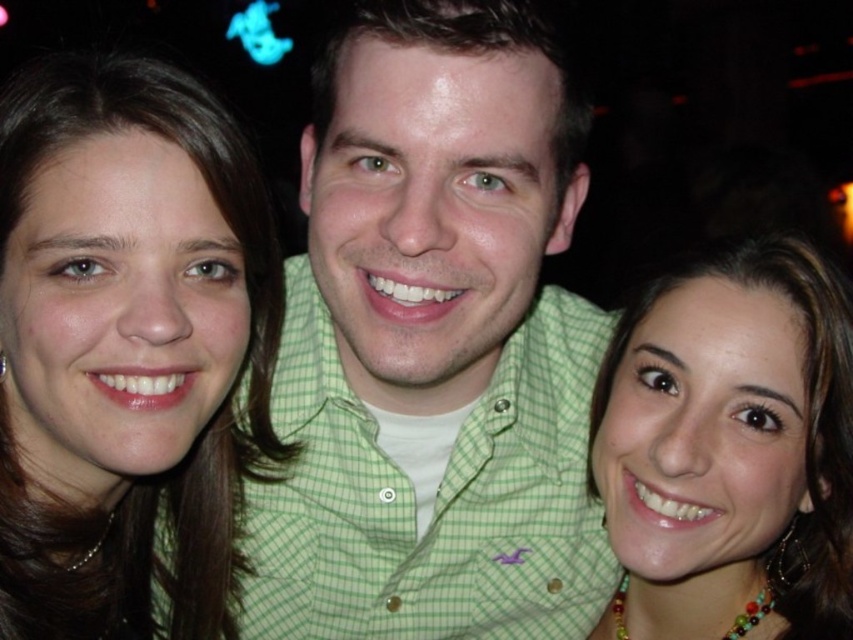
Does green checkered shirt at center have a lesser width compared to matte brown hair at center?

No.

Measure the distance between green checkered shirt at center and camera.

A distance of 29.92 inches exists between green checkered shirt at center and camera.

Is point (376, 627) farther from viewer compared to point (241, 209)?

Yes.

The image size is (853, 640). What are the coordinates of `green checkered shirt at center` in the screenshot? It's located at (434, 344).

Who is more distant from viewer, (199, 148) or (730, 504)?

The point (730, 504) is more distant.

Is matte brown hair at center in front of matte gold necklace at lower right?

Yes, it is in front of matte gold necklace at lower right.

Who is more distant from viewer, (x=222, y=358) or (x=788, y=387)?

The point (x=222, y=358) is behind.

In order to click on matte brown hair at center in this screenshot , I will do `click(126, 346)`.

Based on the photo, which is more to the left, green checkered shirt at center or matte gold necklace at lower right?

From the viewer's perspective, green checkered shirt at center appears more on the left side.

Between green checkered shirt at center and matte gold necklace at lower right, which one appears on the right side from the viewer's perspective?

From the viewer's perspective, matte gold necklace at lower right appears more on the right side.

Where is `green checkered shirt at center`? green checkered shirt at center is located at coordinates (434, 344).